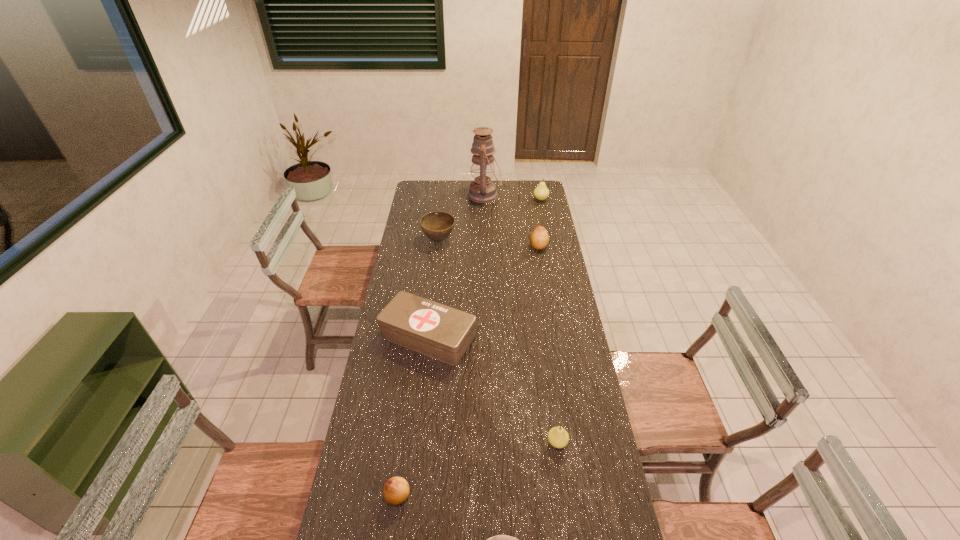
Where is `free spot between the bigger green pear and the leftmost pear`? The height and width of the screenshot is (540, 960). free spot between the bigger green pear and the leftmost pear is located at coordinates (x=469, y=348).

Locate an element on the screen. Image resolution: width=960 pixels, height=540 pixels. free spot between the right brown pear and the oil lamp is located at coordinates (512, 221).

At what (x,y) coordinates should I click in order to perform the action: click on vacant space that is in between the farther bowl and the fifth farthest object. Please return your answer as a coordinate pair (x, y). The height and width of the screenshot is (540, 960). Looking at the image, I should click on (434, 288).

Find the location of `free area in between the first-aid kit and the taller bowl`. free area in between the first-aid kit and the taller bowl is located at coordinates (434, 288).

The image size is (960, 540). What are the coordinates of `free spot between the left bowl and the left green pear` in the screenshot? It's located at (498, 341).

At what (x,y) coordinates should I click in order to perform the action: click on object that is the fourth closest one to the leftmost pear. Please return your answer as a coordinate pair (x, y). The height and width of the screenshot is (540, 960). Looking at the image, I should click on (437, 226).

Image resolution: width=960 pixels, height=540 pixels. I want to click on object that is the seventh closest one to the left bowl, so click(499, 539).

Image resolution: width=960 pixels, height=540 pixels. I want to click on pear that is the second closest one to the bigger brown pear, so click(558, 437).

Select which pear is the third closest to the farther brown pear. Please provide its 2D coordinates. Your answer should be formatted as a tuple, i.e. [(x, y)], where the tuple contains the x and y coordinates of a point satisfying the conditions above.

[(396, 490)]

Identify the location of vacant space that satisfies the following two spatial constraints: 1. on the back side of the first-aid kit; 2. on the left side of the tallest object. (444, 195).